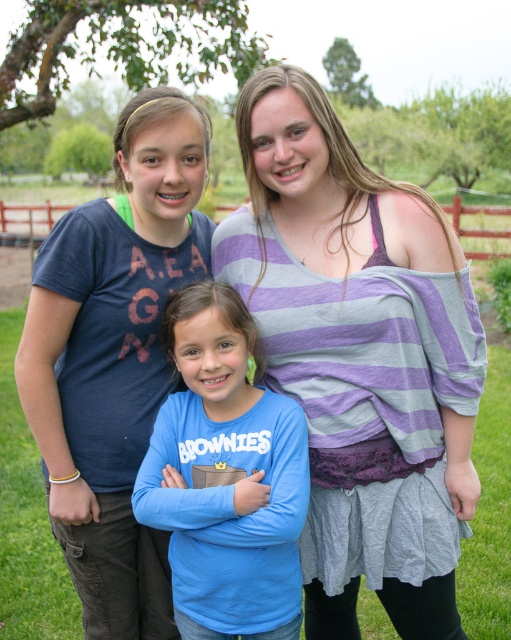
You are a photographer trying to capture a photo of the two people wearing the striped fabric top at center and the blue cotton shirt at center. Which one should you focus on first if you want to include both in the frame without moving the camera?

The striped fabric top at center is located above the blue cotton shirt at center, so you should focus on the striped fabric top at center first to ensure both are in the frame.